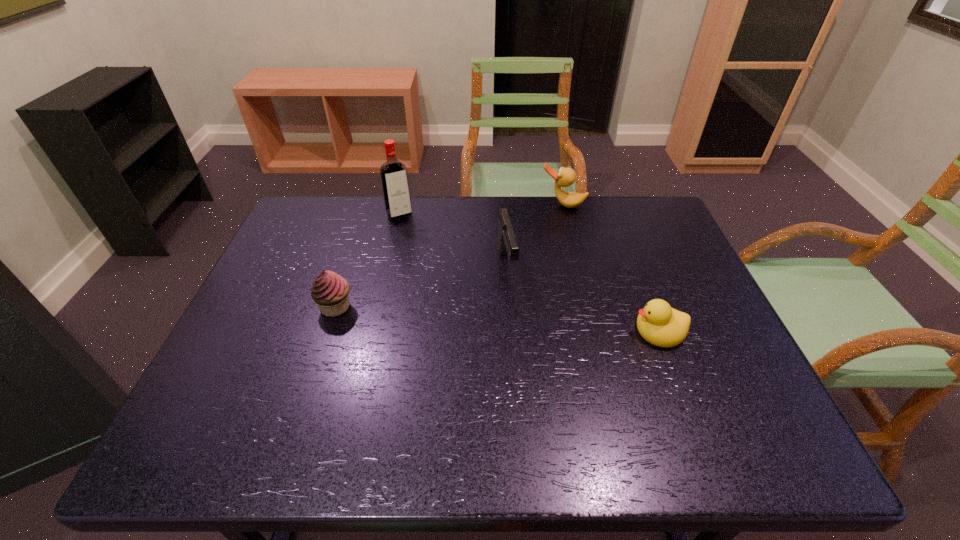
You are a GUI agent. You are given a task and a screenshot of the screen. Output one action in this format:
    pyautogui.click(x=<x>, y=<y>)
    Task: Click on the leftmost object
    This screenshot has height=540, width=960.
    Given the screenshot: What is the action you would take?
    pyautogui.click(x=330, y=291)

I want to click on duckling, so click(x=659, y=324).

This screenshot has width=960, height=540. I want to click on the rightmost object, so click(659, 324).

The height and width of the screenshot is (540, 960). I want to click on the fourth object from right to left, so click(x=394, y=178).

Where is `the tallest object`? The height and width of the screenshot is (540, 960). the tallest object is located at coordinates (394, 178).

The height and width of the screenshot is (540, 960). Identify the location of the fourth object from left to right. (565, 177).

Where is `the third object from right to left`? the third object from right to left is located at coordinates (506, 241).

Identify the location of the third farthest object. (506, 241).

Identify the location of free region located on the back of the leftmost object. (364, 220).

Where is `free region located 0.070m on the face of the shortest object`? free region located 0.070m on the face of the shortest object is located at coordinates (604, 330).